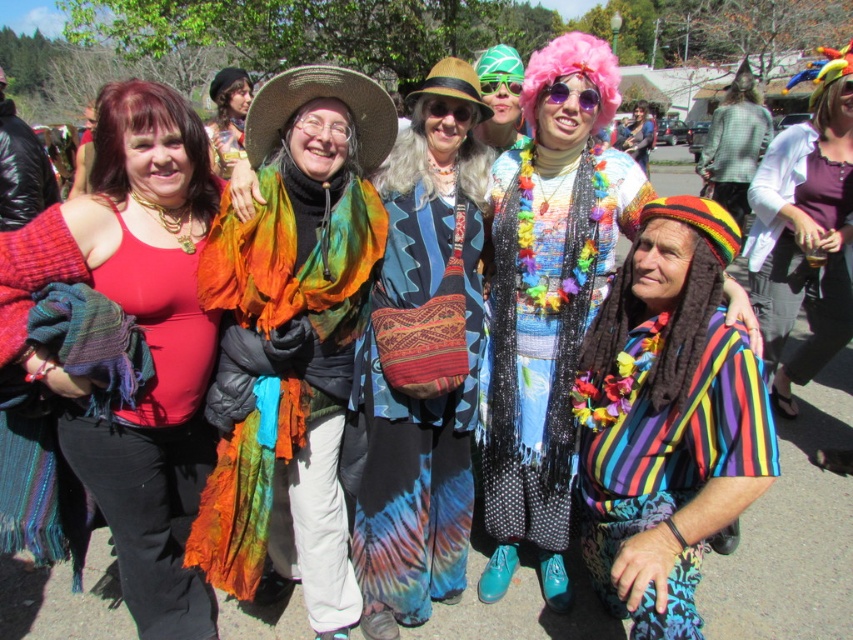
Question: Which object appears farthest from the camera in this image?

Choices:
 (A) rainbow scarf at center
 (B) matte red tank top at left
 (C) pink synthetic wig at upper center

Answer: (C)

Question: Which point is closer to the camera?

Choices:
 (A) tap(788, 212)
 (B) tap(316, 579)

Answer: (B)

Question: Is multicolored scarf at center closer to camera compared to multicolored fabric wig at center?

Choices:
 (A) no
 (B) yes

Answer: (B)

Question: Which object appears closest to the camera in this image?

Choices:
 (A) rainbow scarf at center
 (B) rainbow striped shirt at center

Answer: (B)

Question: Can you confirm if rainbow striped shirt at center is positioned below white knit cardigan at center?

Choices:
 (A) yes
 (B) no

Answer: (A)

Question: Can you confirm if rainbow striped scarf at lower right is positioned to the right of multicolored scarf at center?

Choices:
 (A) yes
 (B) no

Answer: (A)